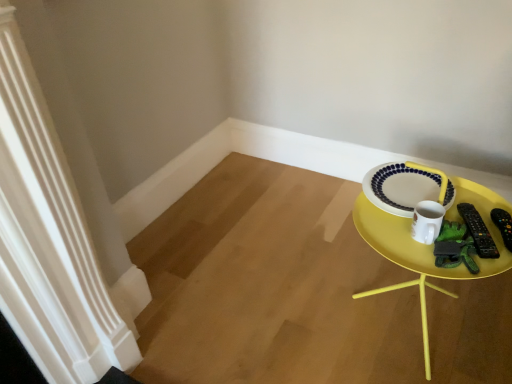
Question: Is yellow plastic tray at right positioned far away from black plastic remote control at right, the 1th remote control in the right-to-left sequence?

Choices:
 (A) no
 (B) yes

Answer: (A)

Question: From the image's perspective, is yellow plastic tray at right on black plastic remote control at right, the second remote control from the left?

Choices:
 (A) yes
 (B) no

Answer: (B)

Question: From the image's perspective, is yellow plastic tray at right located beneath black plastic remote control at right, the 1th remote control in the right-to-left sequence?

Choices:
 (A) yes
 (B) no

Answer: (A)

Question: Does yellow plastic tray at right have a greater width compared to black plastic remote control at right, the 1th remote control in the right-to-left sequence?

Choices:
 (A) no
 (B) yes

Answer: (B)

Question: Is yellow plastic tray at right with black plastic remote control at right, the 1th remote control in the right-to-left sequence?

Choices:
 (A) yes
 (B) no

Answer: (B)

Question: From a real-world perspective, relative to black plastic remote control at right, the second remote control from the left, is yellow plastic tray at right vertically above or below?

Choices:
 (A) below
 (B) above

Answer: (A)

Question: Is yellow plastic tray at right taller or shorter than black plastic remote control at right, the 1th remote control in the right-to-left sequence?

Choices:
 (A) tall
 (B) short

Answer: (A)

Question: Would you say yellow plastic tray at right is inside or outside black plastic remote control at right, the 1th remote control in the right-to-left sequence?

Choices:
 (A) outside
 (B) inside

Answer: (A)

Question: Is point (495, 266) positioned closer to the camera than point (507, 221)?

Choices:
 (A) farther
 (B) closer

Answer: (B)

Question: Considering the relative positions of black plastic remote control at right, the second remote control from the left, and black plastic remote control at right, which is the second remote control from right to left, in the image provided, is black plastic remote control at right, the second remote control from the left, to the left or to the right of black plastic remote control at right, which is the second remote control from right to left,?

Choices:
 (A) right
 (B) left

Answer: (A)

Question: In the image, is black plastic remote control at right, the second remote control from the left, positioned in front of or behind black plastic remote control at right, which is the second remote control from right to left?

Choices:
 (A) behind
 (B) front

Answer: (A)

Question: From a real-world perspective, relative to black plastic remote control at right, the 1th remote control from the left, is black plastic remote control at right, the second remote control from the left, vertically above or below?

Choices:
 (A) above
 (B) below

Answer: (B)

Question: Is black plastic remote control at right, the second remote control from the left, situated inside black plastic remote control at right, which is the second remote control from right to left, or outside?

Choices:
 (A) outside
 (B) inside

Answer: (A)

Question: From a real-world perspective, is black plastic remote control at right, the 1th remote control in the right-to-left sequence, positioned above or below white glossy mug at right?

Choices:
 (A) above
 (B) below

Answer: (B)

Question: Based on their positions, is black plastic remote control at right, the 1th remote control in the right-to-left sequence, located to the left or right of white glossy mug at right?

Choices:
 (A) left
 (B) right

Answer: (B)